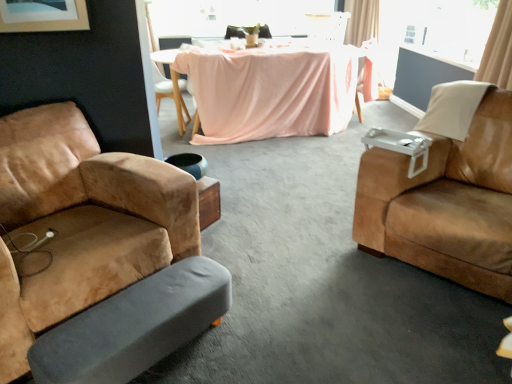
Question: Does pink fabric-covered table at center have a lesser width compared to white glossy armchair at upper center?

Choices:
 (A) no
 (B) yes

Answer: (A)

Question: Considering the relative positions of pink fabric-covered table at center and white glossy armchair at upper center in the image provided, is pink fabric-covered table at center to the left of white glossy armchair at upper center from the viewer's perspective?

Choices:
 (A) yes
 (B) no

Answer: (A)

Question: Could you tell me if pink fabric-covered table at center is facing white glossy armchair at upper center?

Choices:
 (A) yes
 (B) no

Answer: (B)

Question: From a real-world perspective, does pink fabric-covered table at center stand above white glossy armchair at upper center?

Choices:
 (A) yes
 (B) no

Answer: (B)

Question: Is pink fabric-covered table at center shorter than white glossy armchair at upper center?

Choices:
 (A) yes
 (B) no

Answer: (B)

Question: Looking at the image, does transparent glass window at upper center seem bigger or smaller compared to beige fabric curtain at upper right, the 1th curtain when ordered from bottom to top?

Choices:
 (A) big
 (B) small

Answer: (B)

Question: From the image's perspective, relative to beige fabric curtain at upper right, the 1th curtain when ordered from bottom to top, is transparent glass window at upper center above or below?

Choices:
 (A) above
 (B) below

Answer: (A)

Question: In the image, is transparent glass window at upper center positioned in front of or behind beige fabric curtain at upper right, which is the 1th curtain in front-to-back order?

Choices:
 (A) front
 (B) behind

Answer: (B)

Question: Which is correct: transparent glass window at upper center is inside beige fabric curtain at upper right, the 1th curtain when ordered from bottom to top, or outside of it?

Choices:
 (A) inside
 (B) outside

Answer: (B)

Question: Is white wood chair at upper center, which appears as the 1th chair when viewed from the left, wider or thinner than gray fabric footrest at lower left?

Choices:
 (A) thin
 (B) wide

Answer: (B)

Question: From a real-world perspective, relative to gray fabric footrest at lower left, is white wood chair at upper center, which appears as the 1th chair when viewed from the left, vertically above or below?

Choices:
 (A) above
 (B) below

Answer: (A)

Question: Considering their positions, is white wood chair at upper center, arranged as the third chair when viewed from the front, located in front of or behind gray fabric footrest at lower left?

Choices:
 (A) behind
 (B) front

Answer: (A)

Question: Based on their positions, is white wood chair at upper center, which is counted as the second chair, starting from the back, located to the left or right of gray fabric footrest at lower left?

Choices:
 (A) right
 (B) left

Answer: (B)

Question: Does point (499, 23) appear closer or farther from the camera than point (313, 36)?

Choices:
 (A) closer
 (B) farther

Answer: (A)

Question: From a real-world perspective, is beige fabric curtain at upper right, the 2th curtain from the back, above or below white glossy armchair at upper center?

Choices:
 (A) below
 (B) above

Answer: (B)